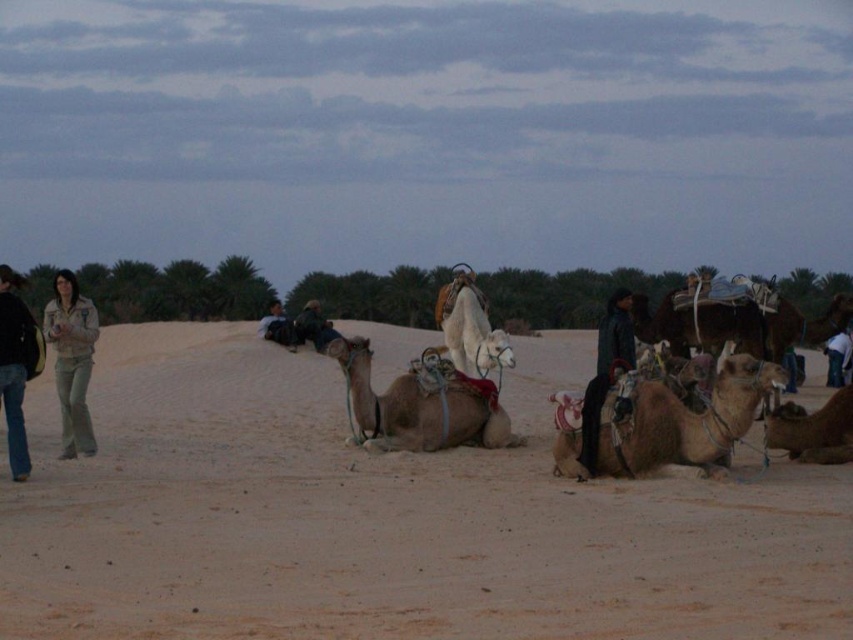
Can you confirm if brown textured camel at center is bigger than dark blue leather jacket at center?

No.

Consider the image. Is brown textured camel at center shorter than dark blue leather jacket at center?

Correct, brown textured camel at center is not as tall as dark blue leather jacket at center.

Image resolution: width=853 pixels, height=640 pixels. Find the location of `brown textured camel at center`. brown textured camel at center is located at coordinates (680, 419).

Between point (355, 518) and point (378, 422), which one is positioned in front?

Point (355, 518)

At what (x,y) coordinates should I click in order to perform the action: click on brown sandy desert at center. Please return your answer as a coordinate pair (x, y). The width and height of the screenshot is (853, 640). Looking at the image, I should click on click(386, 518).

Is point (613, 420) positioned in front of point (463, 275)?

Yes, it is.

From the picture: Can you confirm if brown textured camel at center is positioned to the right of white matte camel at center?

Yes, brown textured camel at center is to the right of white matte camel at center.

Who is more forward, (752, 360) or (506, 349)?

Point (752, 360) is in front.

Locate an element on the screen. The width and height of the screenshot is (853, 640). brown textured camel at center is located at coordinates (680, 419).